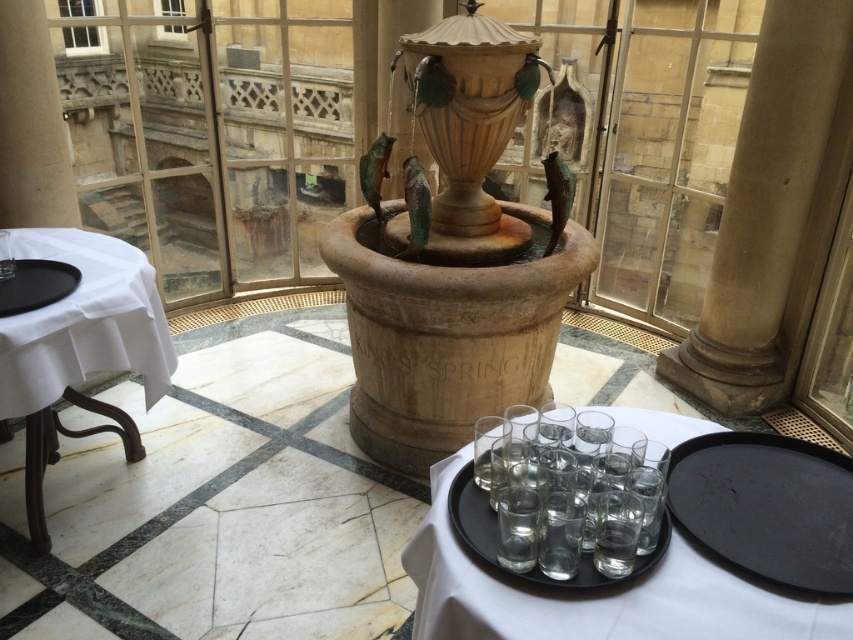
Who is more distant from viewer, (537, 620) or (97, 362)?

Point (97, 362)

Can you confirm if clear glass tray at center is positioned to the left of white cloth-covered table at left?

In fact, clear glass tray at center is to the right of white cloth-covered table at left.

Between point (724, 636) and point (24, 397), which one is positioned behind?

Positioned behind is point (24, 397).

I want to click on clear glass tray at center, so click(601, 595).

Is clear glass tray at center below black matte tray at lower right?

Correct, clear glass tray at center is located below black matte tray at lower right.

Is clear glass tray at center further to camera compared to black matte tray at lower right?

No, clear glass tray at center is in front of black matte tray at lower right.

Is point (679, 545) behind point (706, 513)?

No, it is in front of (706, 513).

Where is `clear glass tray at center`? The image size is (853, 640). clear glass tray at center is located at coordinates (601, 595).

From the picture: Who is lower down, beige stone fountain at center or black matte tray at lower right?

black matte tray at lower right is lower down.

Between beige stone fountain at center and black matte tray at lower right, which one appears on the right side from the viewer's perspective?

black matte tray at lower right is more to the right.

The height and width of the screenshot is (640, 853). In order to click on beige stone fountain at center in this screenshot , I will do `click(453, 259)`.

Image resolution: width=853 pixels, height=640 pixels. Identify the location of beige stone fountain at center. (453, 259).